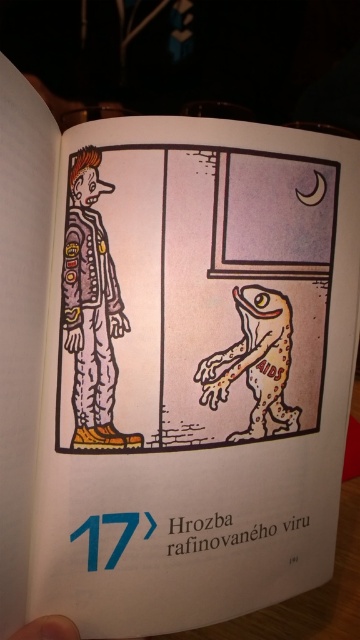
Question: Can you confirm if matte purple jumpsuit at center is positioned below brown textured lizard at center?

Choices:
 (A) no
 (B) yes

Answer: (A)

Question: From the image, what is the correct spatial relationship of matte purple jumpsuit at center in relation to brown textured lizard at center?

Choices:
 (A) below
 (B) above

Answer: (B)

Question: Does matte purple jumpsuit at center have a lesser width compared to brown textured lizard at center?

Choices:
 (A) no
 (B) yes

Answer: (B)

Question: Among these points, which one is nearest to the camera?

Choices:
 (A) (83, 148)
 (B) (276, 353)

Answer: (A)